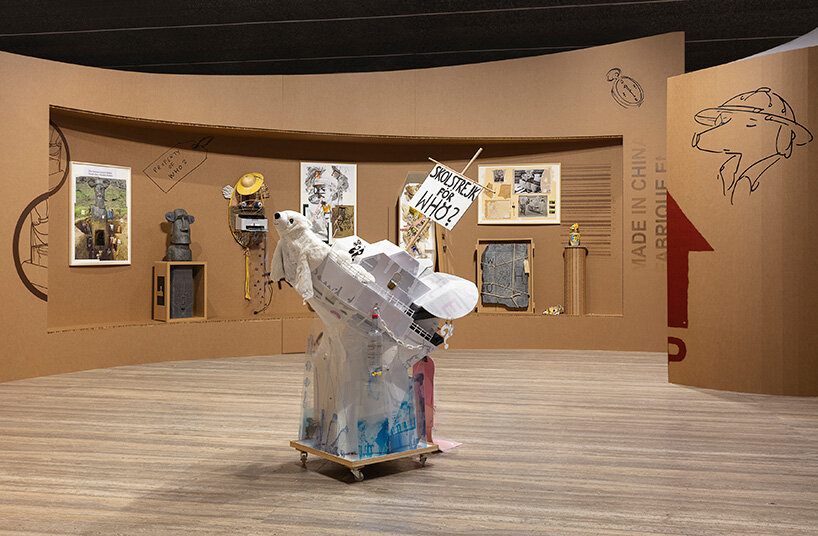
You are a GUI agent. You are given a task and a screenshot of the screen. Output one action in this format:
    pyautogui.click(x=<x>, y=<y>)
    Task: Click on the wooden trolley
    Image resolution: width=818 pixels, height=536 pixels.
    Given the screenshot: What is the action you would take?
    coord(353,468)